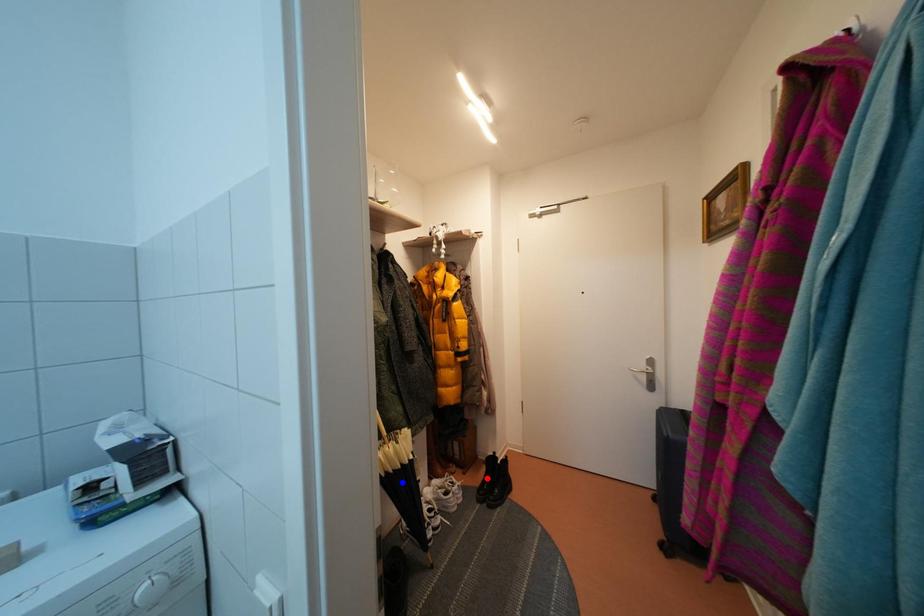
Question: Which of the two points in the image is closer to the camera?

Choices:
 (A) Blue point is closer.
 (B) Red point is closer.

Answer: (A)